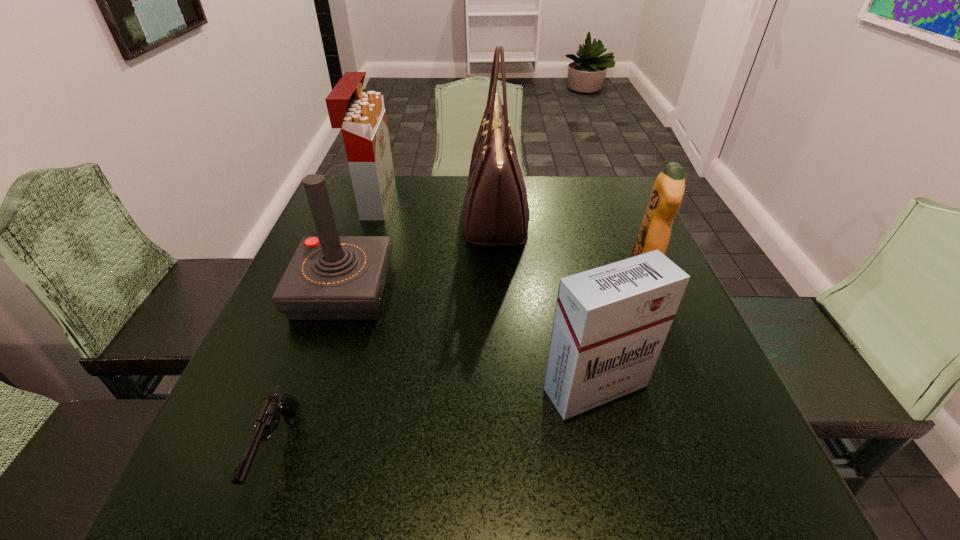
Where is `vacant area that satisfies the following two spatial constraints: 1. with the lid open on the farther cigarette case; 2. on the rectangular base of the joystick`? The height and width of the screenshot is (540, 960). vacant area that satisfies the following two spatial constraints: 1. with the lid open on the farther cigarette case; 2. on the rectangular base of the joystick is located at coordinates (345, 291).